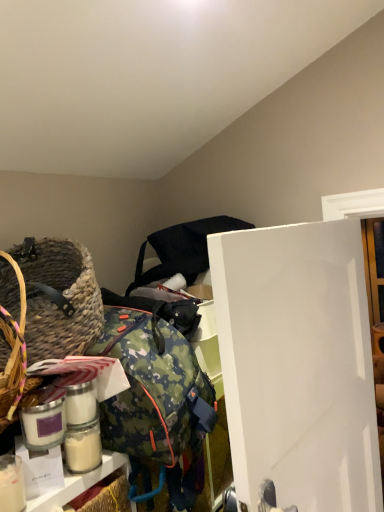
Locate an element on the screen. The image size is (384, 512). white matte glass jar at lower left is located at coordinates (83, 447).

This screenshot has width=384, height=512. Describe the element at coordinates (83, 447) in the screenshot. I see `white matte glass jar at lower left` at that location.

At what (x,y) coordinates should I click in order to perform the action: click on black fabric bag at upper center. Please return your answer as a coordinate pair (x, y). The image size is (384, 512). Looking at the image, I should click on tap(182, 249).

From a real-world perspective, between white matte glass jar at lower left and white glossy door at center right, who is vertically higher?

white matte glass jar at lower left, from a real-world perspective.

Is white matte glass jar at lower left positioned far away from white glossy door at center right?

Actually, white matte glass jar at lower left and white glossy door at center right are a little close together.

Where is `glass jar that is on the left side of white glossy door at center right`? glass jar that is on the left side of white glossy door at center right is located at coordinates (83, 447).

Can woven straw picnic basket at left be found inside white glossy door at center right?

No.

From a real-world perspective, who is located lower, white glossy door at center right or woven straw picnic basket at left?

white glossy door at center right is physically lower.

Considering their positions, is white glossy door at center right located in front of or behind woven straw picnic basket at left?

white glossy door at center right is positioned closer to the viewer than woven straw picnic basket at left.

Who is smaller, white glossy door at center right or woven straw picnic basket at left?

With smaller size is woven straw picnic basket at left.

Which object is closer to the camera taking this photo, woven straw picnic basket at left or white matte glass jar at lower left?

Positioned in front is woven straw picnic basket at left.

In terms of width, does woven straw picnic basket at left look wider or thinner when compared to white matte glass jar at lower left?

Considering their sizes, woven straw picnic basket at left looks broader than white matte glass jar at lower left.

Does woven straw picnic basket at left contain white matte glass jar at lower left?

No, white matte glass jar at lower left is not a part of woven straw picnic basket at left.

Is point (72, 466) positioned in front of point (70, 295)?

Yes, it is.

From a real-world perspective, which object rests below the other?

white matte glass jar at lower left, from a real-world perspective.

Would you consider white matte glass jar at lower left to be distant from woven straw picnic basket at left?

No, white matte glass jar at lower left is in close proximity to woven straw picnic basket at left.

How distant is white matte glass jar at lower left from woven straw picnic basket at left?

white matte glass jar at lower left is 13.11 inches away from woven straw picnic basket at left.

In the scene shown: Relative to white glossy door at center right, is black fabric bag at upper center in front or behind?

black fabric bag at upper center is behind white glossy door at center right.

From the image's perspective, which one is positioned higher, black fabric bag at upper center or white glossy door at center right?

black fabric bag at upper center, from the image's perspective.

Is black fabric bag at upper center not close to white glossy door at center right?

No.

Is black fabric bag at upper center spatially inside white glossy door at center right, or outside of it?

black fabric bag at upper center is located beyond the bounds of white glossy door at center right.

Measure the distance from white matte glass jar at lower left to black fabric bag at upper center.

They are 26.07 inches apart.

The height and width of the screenshot is (512, 384). Identify the location of bag above the white matte glass jar at lower left (from a real-world perspective). (182, 249).

Consider the image. Which of these two, white matte glass jar at lower left or black fabric bag at upper center, is wider?

black fabric bag at upper center.

From a real-world perspective, between white matte glass jar at lower left and black fabric bag at upper center, who is vertically higher?

black fabric bag at upper center is physically above.

Would you say white glossy door at center right is a long distance from black fabric bag at upper center?

white glossy door at center right is near black fabric bag at upper center, not far away.

Would you say black fabric bag at upper center is part of white glossy door at center right's contents?

No.

Is point (283, 421) more distant than point (174, 259)?

No, (283, 421) is closer to viewer.

Where is `door located in front of the black fabric bag at upper center`? Image resolution: width=384 pixels, height=512 pixels. door located in front of the black fabric bag at upper center is located at coordinates (298, 365).

Where is `door above the white matte glass jar at lower left (from the image's perspective)`? door above the white matte glass jar at lower left (from the image's perspective) is located at coordinates (298, 365).

Locate an element on the screen. door in front of the woven straw picnic basket at left is located at coordinates (298, 365).

From the image, which object appears to be nearer to black fabric bag at upper center, woven straw picnic basket at left or white glossy door at center right?

woven straw picnic basket at left.

Consider the image. Which object lies nearer to the anchor point white matte glass jar at lower left, black fabric bag at upper center or white glossy door at center right?

The object closer to white matte glass jar at lower left is white glossy door at center right.

Which object lies further to the anchor point white matte glass jar at lower left, woven straw picnic basket at left or black fabric bag at upper center?

Based on the image, black fabric bag at upper center appears to be further to white matte glass jar at lower left.

Looking at the image, which one is located further to white matte glass jar at lower left, black fabric bag at upper center or woven straw picnic basket at left?

Among the two, black fabric bag at upper center is located further to white matte glass jar at lower left.

Which object lies nearer to the anchor point black fabric bag at upper center, white matte glass jar at lower left or white glossy door at center right?

Based on the image, white glossy door at center right appears to be nearer to black fabric bag at upper center.

Looking at the image, which one is located further to black fabric bag at upper center, woven straw picnic basket at left or white matte glass jar at lower left?

white matte glass jar at lower left is further to black fabric bag at upper center.

Based on their spatial positions, is black fabric bag at upper center or white glossy door at center right closer to woven straw picnic basket at left?

The object closer to woven straw picnic basket at left is black fabric bag at upper center.

Considering their positions, is white matte glass jar at lower left positioned further to white glossy door at center right than woven straw picnic basket at left?

white matte glass jar at lower left is positioned further to the anchor white glossy door at center right.

Where is `glass jar between woven straw picnic basket at left and black fabric bag at upper center along the z-axis`? glass jar between woven straw picnic basket at left and black fabric bag at upper center along the z-axis is located at coordinates (83, 447).

Identify the location of glass jar positioned between white glossy door at center right and black fabric bag at upper center from near to far. (83, 447).

I want to click on glass jar between woven straw picnic basket at left and white glossy door at center right, so click(83, 447).

I want to click on bag situated between woven straw picnic basket at left and white glossy door at center right from left to right, so point(182,249).